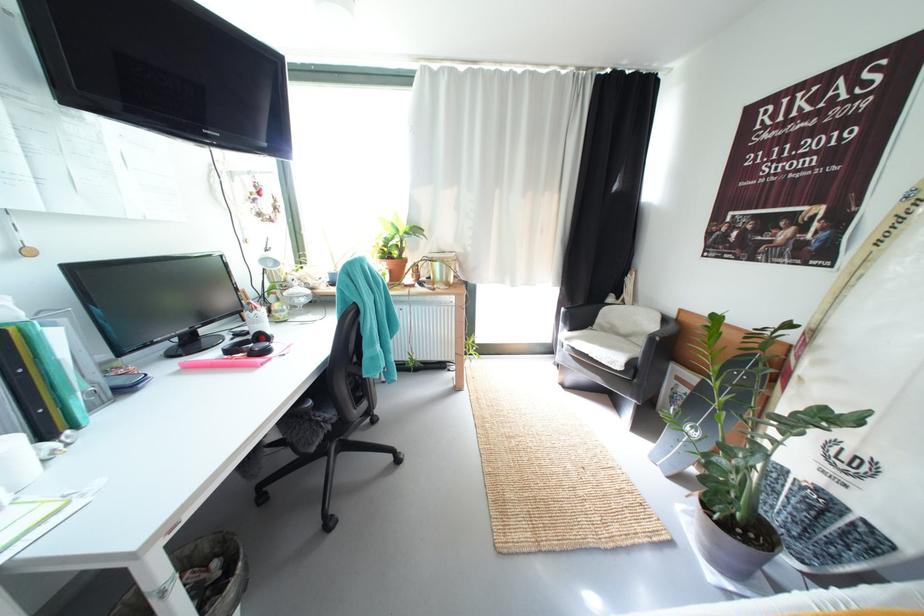
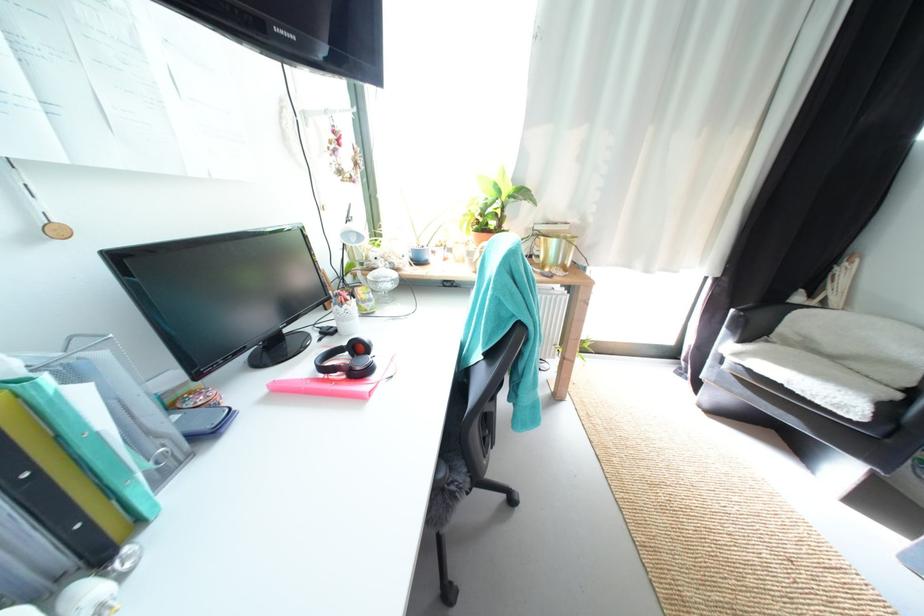
In the second image, find the point that corresponds to (x=406, y=246) in the first image.

(505, 216)